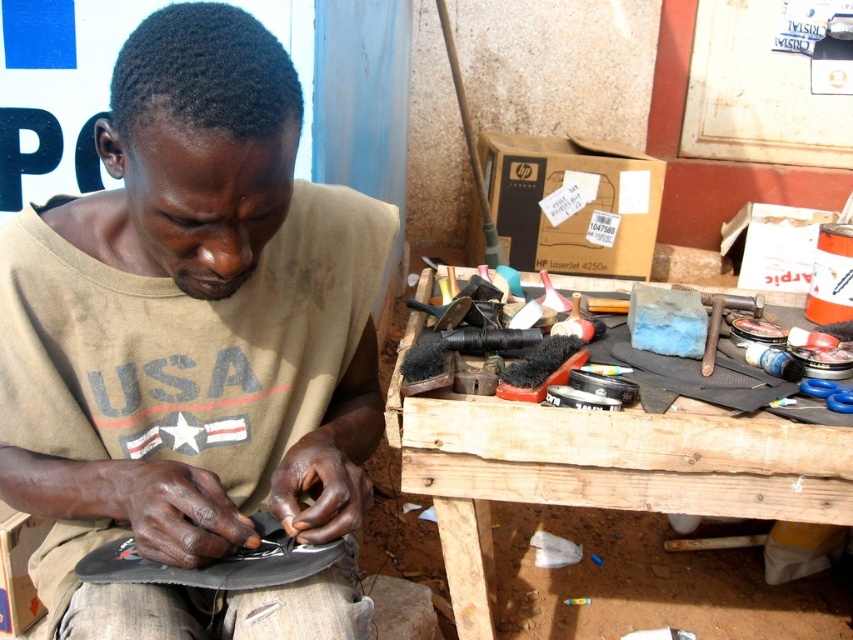
Where is the brown cotton shirt at center located in the image?

The brown cotton shirt at center is located at point 0.537 on the x axis and 0.227 on the y axis.

You are a customer looking to get your shoes repaired. You notice a point at coordinates [193,342] in the image. What object is located at that point?

The point at coordinates [193,342] is on the brown cotton shirt at center.